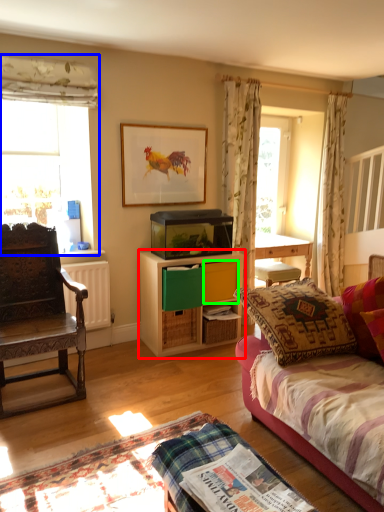
Question: Based on their relative distances, which object is farther from cabinetry (highlighted by a red box)? Choose from window (highlighted by a blue box) and drawer (highlighted by a green box).

Choices:
 (A) window
 (B) drawer

Answer: (A)